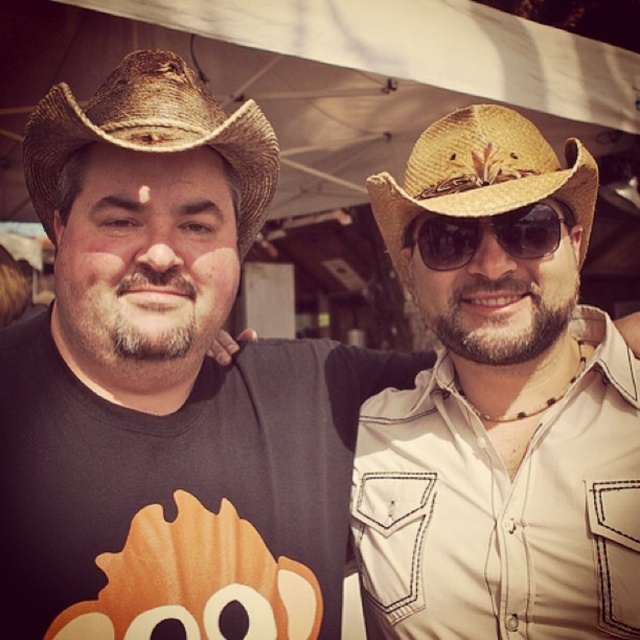
Question: Is natural straw cowboy hat at center further to the viewer compared to sunglasses at center?

Choices:
 (A) no
 (B) yes

Answer: (A)

Question: Can you confirm if brown straw cowboy hat at left is bigger than natural straw cowboy hat at center?

Choices:
 (A) no
 (B) yes

Answer: (A)

Question: Considering the relative positions of brown straw cowboy hat at left and sunglasses at center in the image provided, where is brown straw cowboy hat at left located with respect to sunglasses at center?

Choices:
 (A) below
 (B) above

Answer: (B)

Question: Which object is the farthest from the brown straw cowboy hat at left?

Choices:
 (A) sunglasses at center
 (B) natural straw cowboy hat at center

Answer: (A)

Question: Estimate the real-world distances between objects in this image. Which object is farther from the natural straw cowboy hat at center?

Choices:
 (A) brown straw cowboy hat at left
 (B) sunglasses at center

Answer: (A)

Question: Estimate the real-world distances between objects in this image. Which object is farther from the brown straw cowboy hat at left?

Choices:
 (A) sunglasses at center
 (B) natural straw cowboy hat at center

Answer: (A)